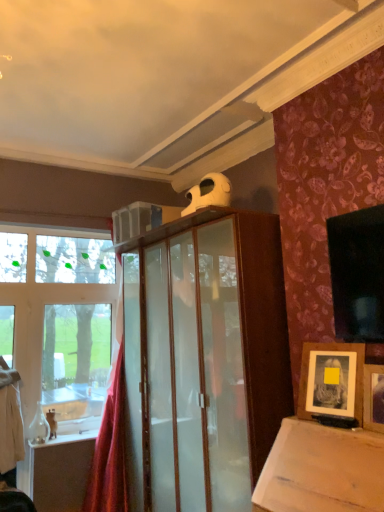
Question: Considering their positions, is red velvet curtain at left located in front of or behind wooden picture frame at upper right, which ranks as the first picture frame in front-to-back order?

Choices:
 (A) front
 (B) behind

Answer: (B)

Question: Considering the relative positions of red velvet curtain at left and wooden picture frame at upper right, which ranks as the first picture frame in front-to-back order, in the image provided, is red velvet curtain at left to the left or to the right of wooden picture frame at upper right, which ranks as the first picture frame in front-to-back order,?

Choices:
 (A) left
 (B) right

Answer: (A)

Question: Estimate the real-world distances between objects in this image. Which object is closer to the wooden framed photo at lower right, the 2th picture frame when ordered from front to back?

Choices:
 (A) red velvet curtain at left
 (B) wooden picture frame at upper right, which ranks as the first picture frame in front-to-back order

Answer: (B)

Question: Estimate the real-world distances between objects in this image. Which object is farther from the wooden framed photo at lower right, the first picture frame viewed from the back?

Choices:
 (A) wooden picture frame at upper right, which ranks as the first picture frame in front-to-back order
 (B) red velvet curtain at left

Answer: (B)